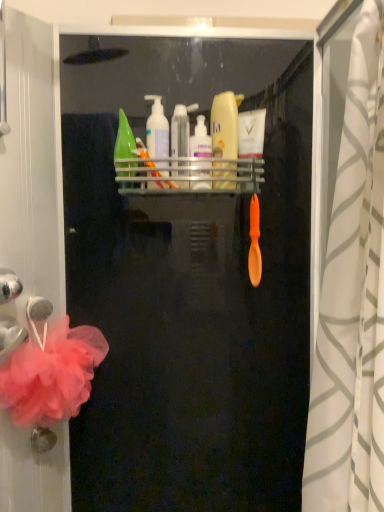
Question: Considering the relative positions of metallic silver shelf at upper center and metallic silver towel bar at left in the image provided, is metallic silver shelf at upper center to the right of metallic silver towel bar at left from the viewer's perspective?

Choices:
 (A) yes
 (B) no

Answer: (A)

Question: From the image's perspective, is metallic silver shelf at upper center on metallic silver towel bar at left?

Choices:
 (A) yes
 (B) no

Answer: (A)

Question: Considering the relative sizes of metallic silver shelf at upper center and metallic silver towel bar at left in the image provided, is metallic silver shelf at upper center wider than metallic silver towel bar at left?

Choices:
 (A) yes
 (B) no

Answer: (A)

Question: Is the depth of metallic silver shelf at upper center less than that of metallic silver towel bar at left?

Choices:
 (A) yes
 (B) no

Answer: (A)

Question: Are metallic silver shelf at upper center and metallic silver towel bar at left far apart?

Choices:
 (A) yes
 (B) no

Answer: (B)

Question: Does metallic silver shelf at upper center have a larger size compared to metallic silver towel bar at left?

Choices:
 (A) no
 (B) yes

Answer: (B)

Question: Is transparent plastic tube at center, arranged as the 3th toiletry when viewed from the right, positioned behind white matte cream at upper center, the 1th toiletry from the right?

Choices:
 (A) no
 (B) yes

Answer: (A)

Question: Does transparent plastic tube at center, arranged as the 3th toiletry when viewed from the right, have a greater height compared to white matte cream at upper center, the 1th toiletry from the right?

Choices:
 (A) yes
 (B) no

Answer: (B)

Question: Can you confirm if transparent plastic tube at center, positioned as the second toiletry in left-to-right order, is smaller than white matte cream at upper center, the 1th toiletry from the right?

Choices:
 (A) no
 (B) yes

Answer: (A)

Question: Is transparent plastic tube at center, arranged as the 3th toiletry when viewed from the right, shorter than white matte cream at upper center, the fourth toiletry when ordered from left to right?

Choices:
 (A) yes
 (B) no

Answer: (A)

Question: Is transparent plastic tube at center, positioned as the second toiletry in left-to-right order, not within white matte cream at upper center, the 1th toiletry from the right?

Choices:
 (A) yes
 (B) no

Answer: (A)

Question: From the image's perspective, does transparent plastic tube at center, arranged as the 3th toiletry when viewed from the right, appear lower than white matte cream at upper center, the 1th toiletry from the right?

Choices:
 (A) yes
 (B) no

Answer: (A)

Question: Is white plastic pump bottle at upper center, marked as the second toiletry in a right-to-left arrangement, positioned beyond the bounds of white textured shower curtain at right?

Choices:
 (A) yes
 (B) no

Answer: (A)